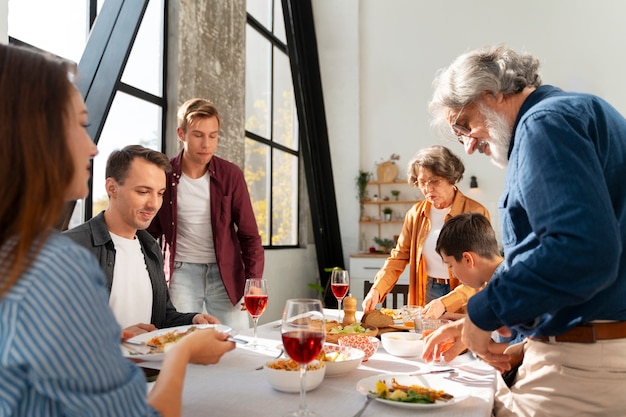
Locate an element on the screen. bowl is located at coordinates (342, 358), (367, 347), (407, 342), (285, 377).